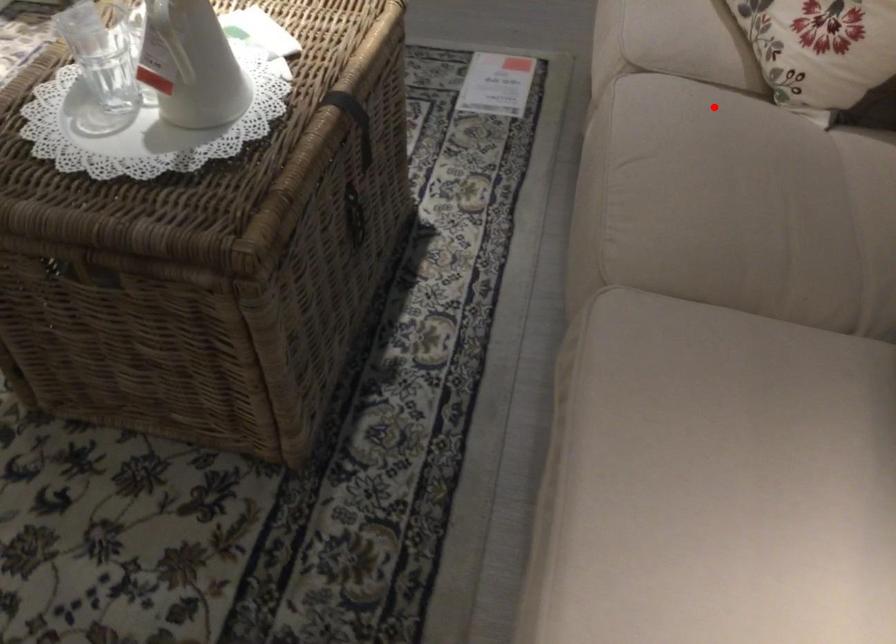
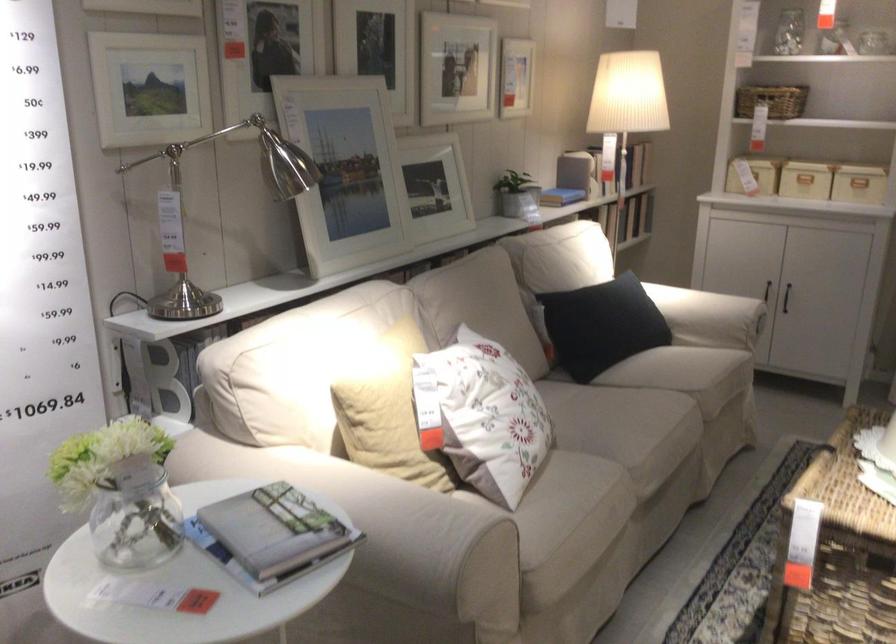
Where in the second image is the point corresponding to the highlighted location from the first image?

(596, 442)